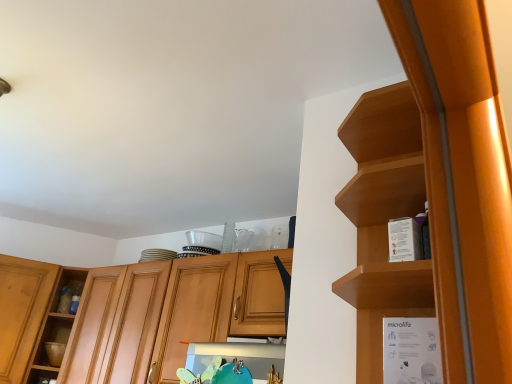
Question: From a real-world perspective, is wooden shelf at upper right, which is the first cabinetry in right-to-left order, positioned above or below wooden cabinet at center, acting as the 2th cabinetry starting from the right?

Choices:
 (A) below
 (B) above

Answer: (B)

Question: Considering the positions of point [x=502, y=304] and point [x=177, y=354], is point [x=502, y=304] closer or farther from the camera than point [x=177, y=354]?

Choices:
 (A) farther
 (B) closer

Answer: (B)

Question: Considering the real-world distances, which object is closest to the white cardboard box at right?

Choices:
 (A) wooden cabinet at center, arranged as the first cabinetry when viewed from the left
 (B) wooden shelf at upper right, which appears as the second cabinetry when viewed from the back

Answer: (B)

Question: Which is nearer to the wooden shelf at upper right, which is the first cabinetry in right-to-left order?

Choices:
 (A) white cardboard box at right
 (B) wooden cabinet at center, arranged as the first cabinetry when viewed from the left

Answer: (A)